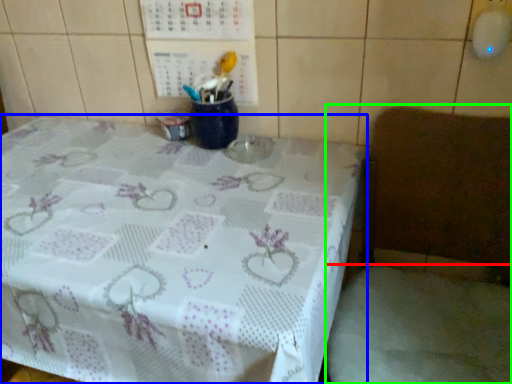
Question: Which is farther away from fabric (highlighted by a red box)? table (highlighted by a blue box) or chair (highlighted by a green box)?

Choices:
 (A) table
 (B) chair

Answer: (A)